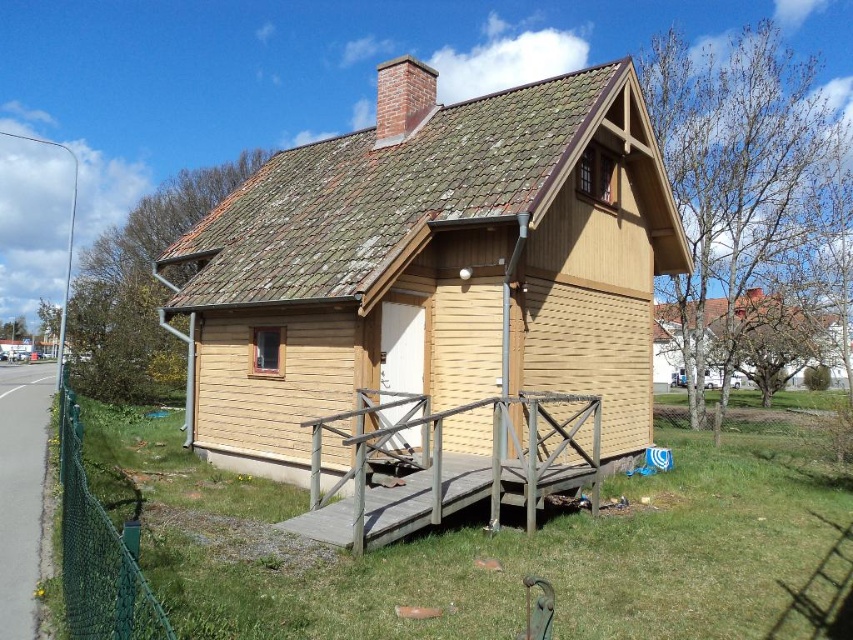
Image resolution: width=853 pixels, height=640 pixels. Find the location of `wooden cabin at center`. wooden cabin at center is located at coordinates [434, 264].

Which is behind, point (535, 115) or point (62, 474)?

Positioned behind is point (535, 115).

You are a GUI agent. You are given a task and a screenshot of the screen. Output one action in this format:
    pyautogui.click(x=<x>, y=<y>)
    Task: Click on the wooden cabin at center
    The height and width of the screenshot is (640, 853).
    Given the screenshot: What is the action you would take?
    pyautogui.click(x=434, y=264)

The image size is (853, 640). Identify the location of wooden cabin at center. (434, 264).

Is wooden cabin at center further to the viewer compared to wooden at lower center?

Yes, it is behind wooden at lower center.

Can you confirm if wooden cabin at center is positioned to the right of wooden at lower center?

In fact, wooden cabin at center is to the left of wooden at lower center.

The image size is (853, 640). Describe the element at coordinates (434, 264) in the screenshot. I see `wooden cabin at center` at that location.

Find the location of a particular element. Image resolution: width=853 pixels, height=640 pixels. wooden cabin at center is located at coordinates (434, 264).

How far apart are wooden at lower center and yellow wood house at center?

72.30 feet

Does point (409, 508) come closer to viewer compared to point (677, 305)?

Yes, point (409, 508) is in front of point (677, 305).

Where is `wooden at lower center`? wooden at lower center is located at coordinates (451, 465).

The height and width of the screenshot is (640, 853). I want to click on wooden at lower center, so click(x=451, y=465).